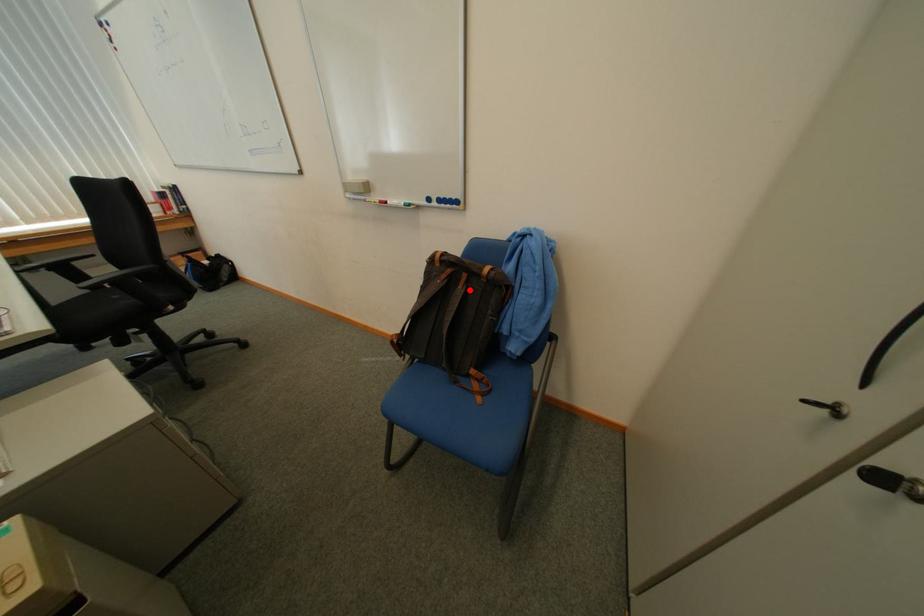
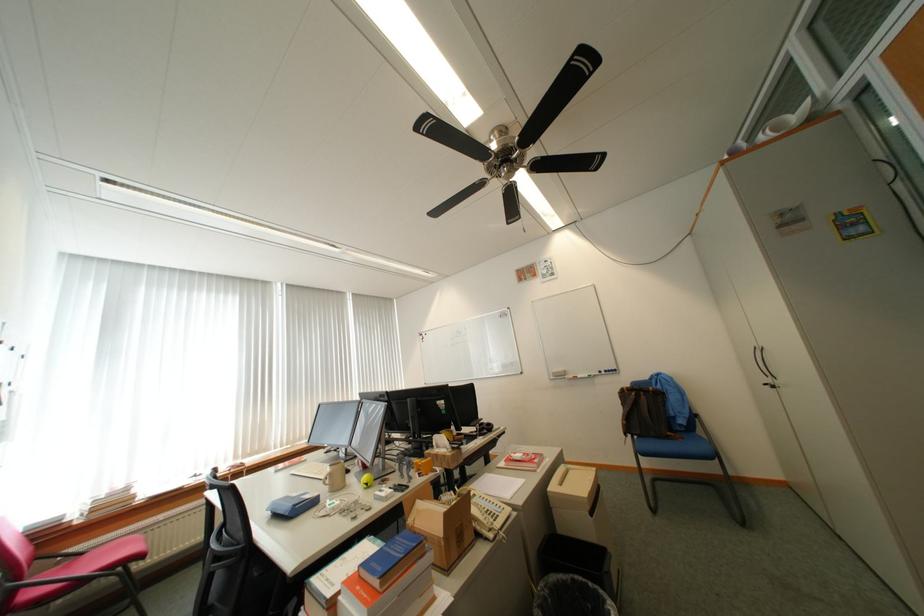
The point at the highlighted location is marked in the first image. Where is the corresponding point in the second image?

(652, 399)